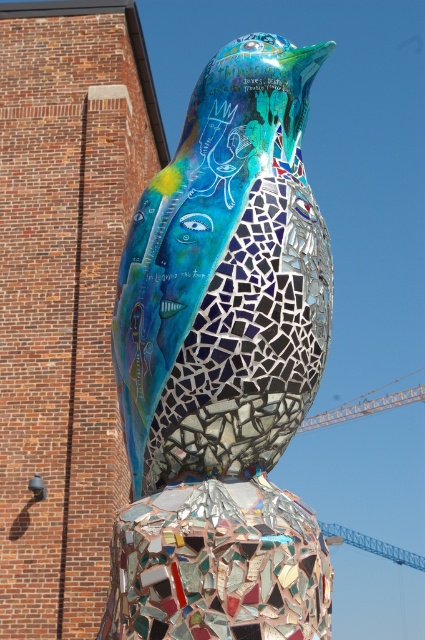
Question: Which point is closer to the camera?

Choices:
 (A) (394, 394)
 (B) (201, 371)

Answer: (B)

Question: Is mosaic bird at center above metallic orange crane at right?

Choices:
 (A) no
 (B) yes

Answer: (B)

Question: Does mosaic bird at center come behind metallic orange crane at right?

Choices:
 (A) yes
 (B) no

Answer: (B)

Question: Observing the image, what is the correct spatial positioning of mosaic bird at center in reference to metallic orange crane at right?

Choices:
 (A) above
 (B) below

Answer: (A)

Question: Which point appears closest to the camera in this image?

Choices:
 (A) (345, 401)
 (B) (311, 637)

Answer: (B)